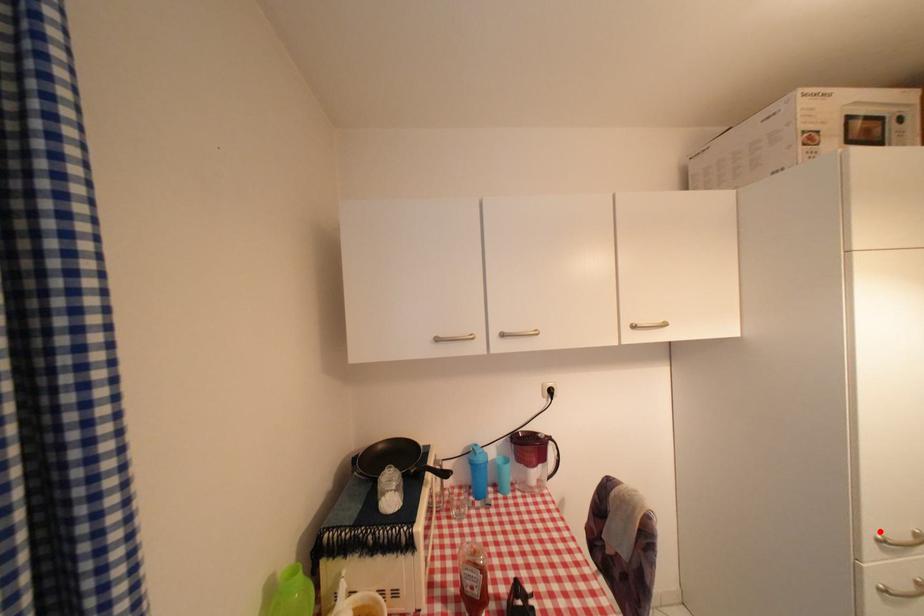
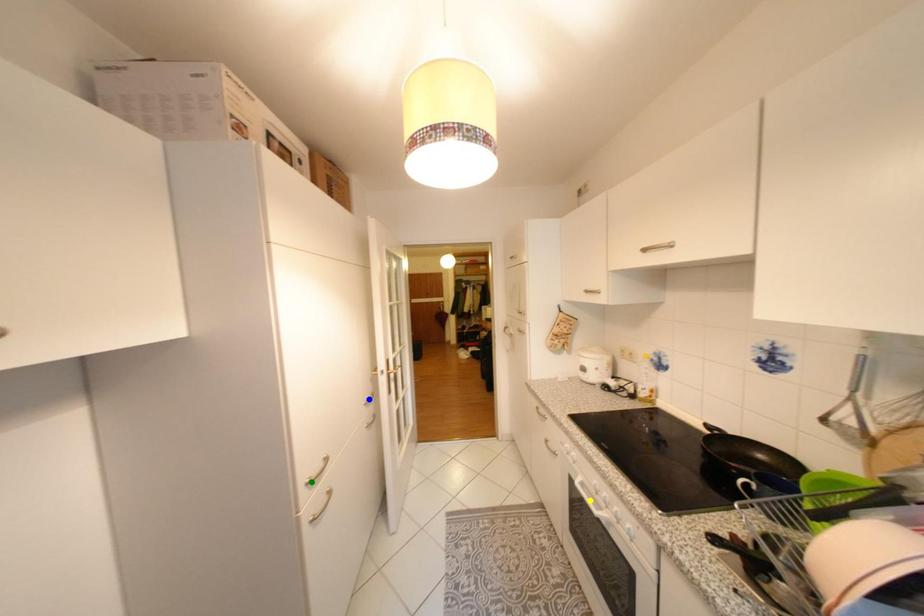
Question: I am providing you with two images of the same scene from different viewpoints. A red point is marked on the first image. You are given multiple points on the second image. In image 2, which mark is for the same physical point as the one in image 1?

Choices:
 (A) green point
 (B) blue point
 (C) yellow point

Answer: (A)